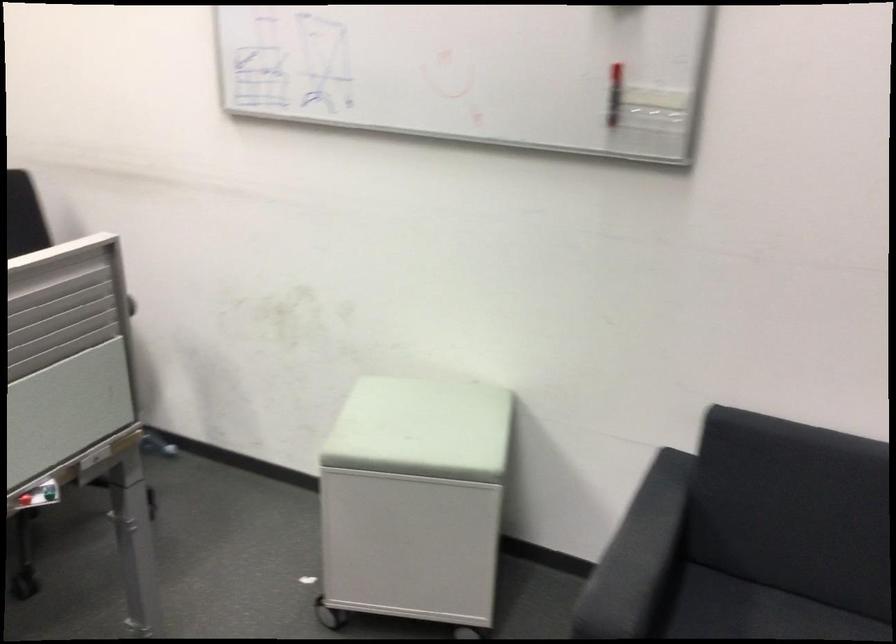
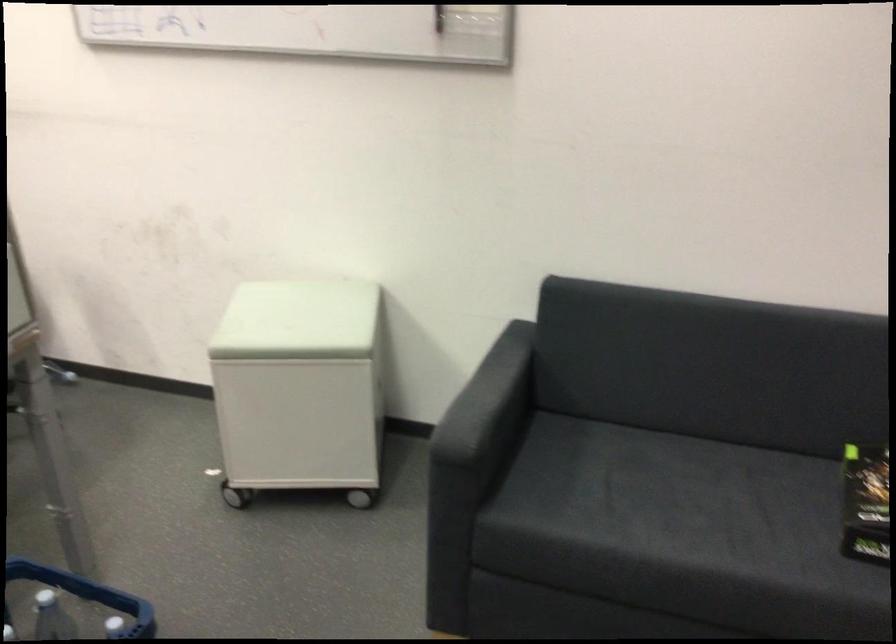
The point at (419, 427) is marked in the first image. Where is the corresponding point in the second image?

(297, 321)